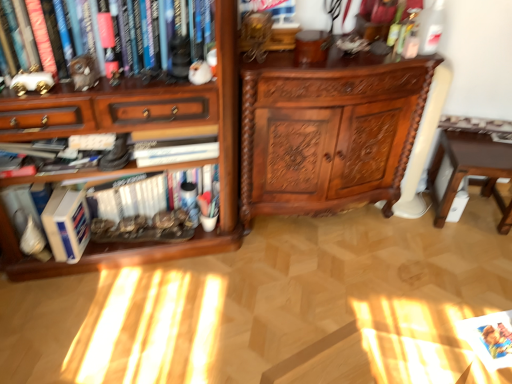
Where is `vacant area that is in front of brown wooden table at lower right`? The height and width of the screenshot is (384, 512). vacant area that is in front of brown wooden table at lower right is located at coordinates (471, 251).